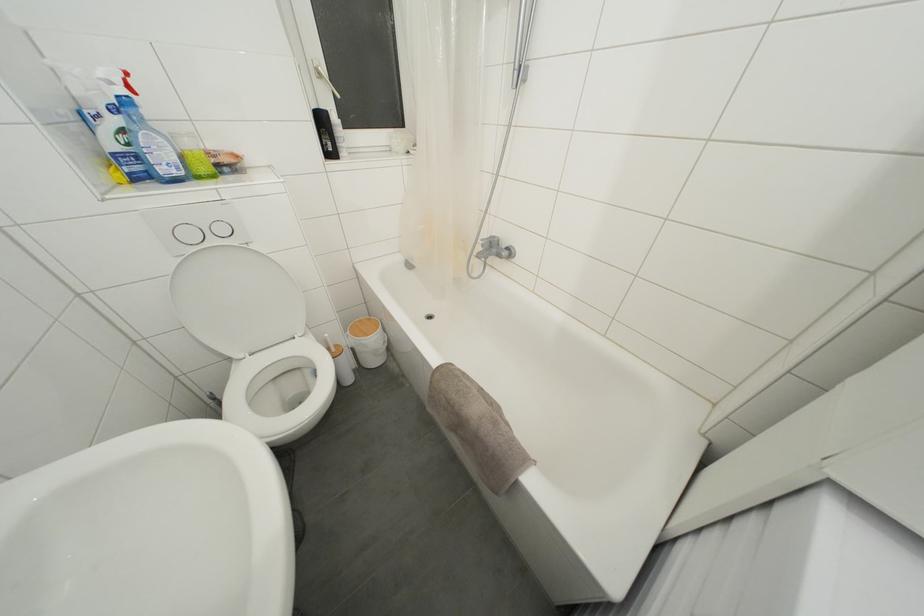
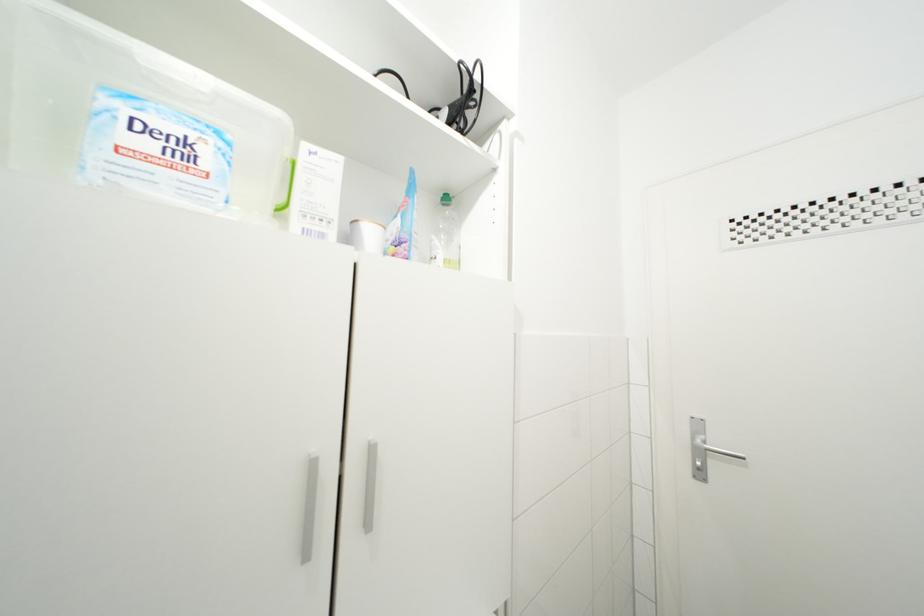
Question: Based on the continuous images, in which direction is the camera rotating? Reply with the corresponding letter.

Choices:
 (A) Left
 (B) Right
 (C) Up
 (D) Down

Answer: (B)